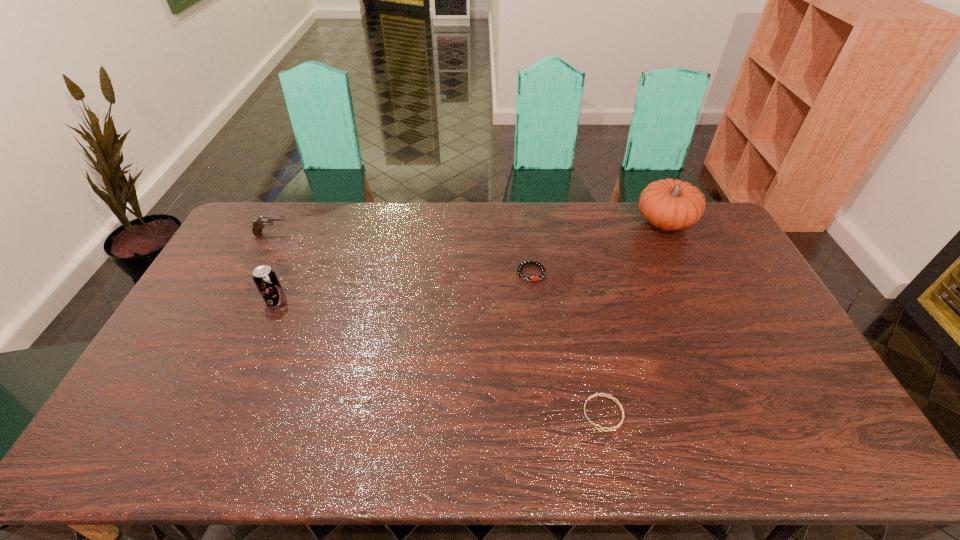
Image resolution: width=960 pixels, height=540 pixels. What are the coordinates of `free location that satisfies the following two spatial constraints: 1. at the barrel of the pistol; 2. on the left side of the farther bracelet` in the screenshot? It's located at (252, 273).

Where is `free location that satisfies the following two spatial constraints: 1. at the barrel of the pistol; 2. on the back side of the second nearest object`? free location that satisfies the following two spatial constraints: 1. at the barrel of the pistol; 2. on the back side of the second nearest object is located at coordinates (237, 301).

Where is `free space that satisfies the following two spatial constraints: 1. on the back side of the third nearest object; 2. on the right side of the rightmost object`? The height and width of the screenshot is (540, 960). free space that satisfies the following two spatial constraints: 1. on the back side of the third nearest object; 2. on the right side of the rightmost object is located at coordinates (525, 222).

Image resolution: width=960 pixels, height=540 pixels. What are the coordinates of `free space that satisfies the following two spatial constraints: 1. at the barrel of the third object from left to right; 2. on the right side of the third shortest object` in the screenshot? It's located at (252, 273).